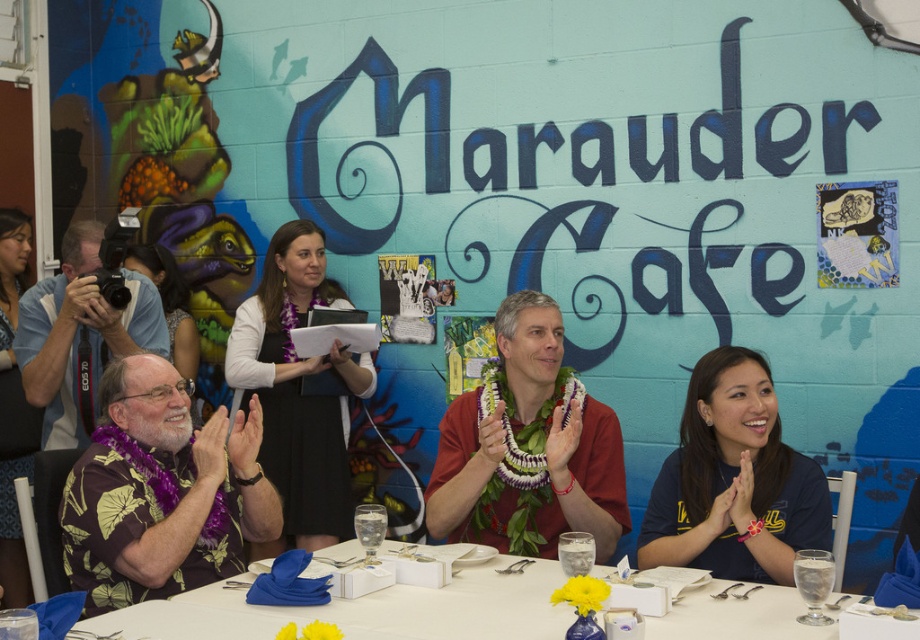
Is blue jersey at center above white glossy table at center?

Yes, blue jersey at center is above white glossy table at center.

Find the location of a particular element. blue jersey at center is located at coordinates (734, 481).

Can you confirm if reddish-brown fabric lei at center is positioned to the right of white glossy table at center?

Yes, reddish-brown fabric lei at center is to the right of white glossy table at center.

Can you confirm if reddish-brown fabric lei at center is thinner than white glossy table at center?

Yes.

Is point (547, 364) less distant than point (737, 616)?

No, it is behind (737, 616).

Where is `reddish-brown fabric lei at center`? reddish-brown fabric lei at center is located at coordinates (529, 449).

Does white glossy table at center have a smaller size compared to purple fabric lei at center?

Indeed, white glossy table at center has a smaller size compared to purple fabric lei at center.

Does point (734, 614) come farther from viewer compared to point (231, 356)?

That is False.

Identify the location of white glossy table at center. This screenshot has width=920, height=640. (366, 611).